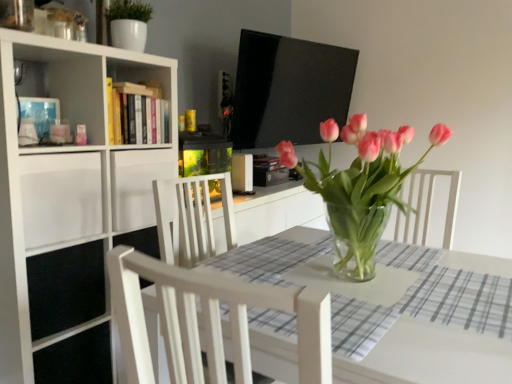
You are a GUI agent. You are given a task and a screenshot of the screen. Output one action in this format:
    pyautogui.click(x=<x>, y=<y>)
    Task: Click on the vacant space in gray checkered tablecloth at center (from a real-world perspective)
    This screenshot has width=512, height=384.
    Given the screenshot: What is the action you would take?
    pyautogui.click(x=465, y=304)